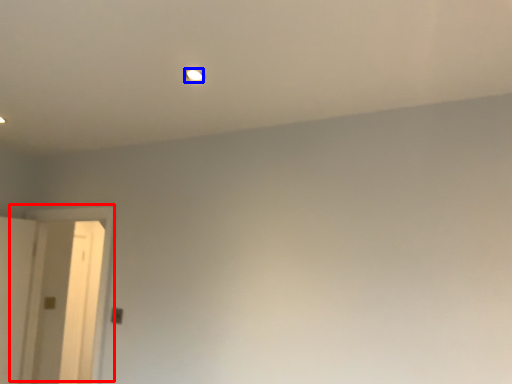
Question: Which point is closer to the camera, door (highlighted by a red box) or light (highlighted by a blue box)?

Choices:
 (A) door
 (B) light

Answer: (B)